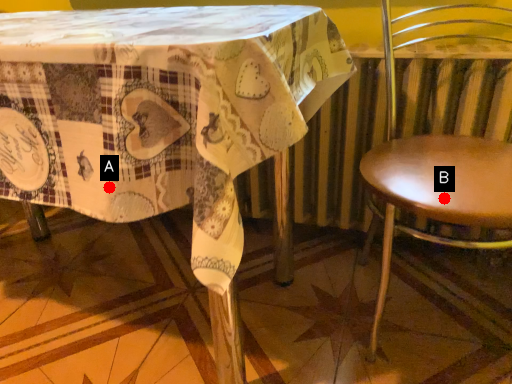
Question: Two points are circled on the image, labeled by A and B beside each circle. Among these points, which one is farthest from the camera?

Choices:
 (A) A is further
 (B) B is further

Answer: (B)